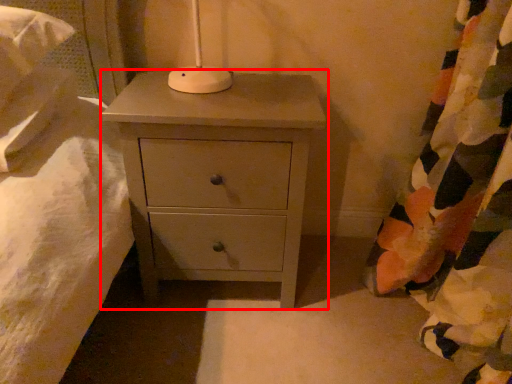
Question: From the image's perspective, what is the correct spatial positioning of chest of drawers (annotated by the red box) in reference to curtain?

Choices:
 (A) below
 (B) above

Answer: (B)